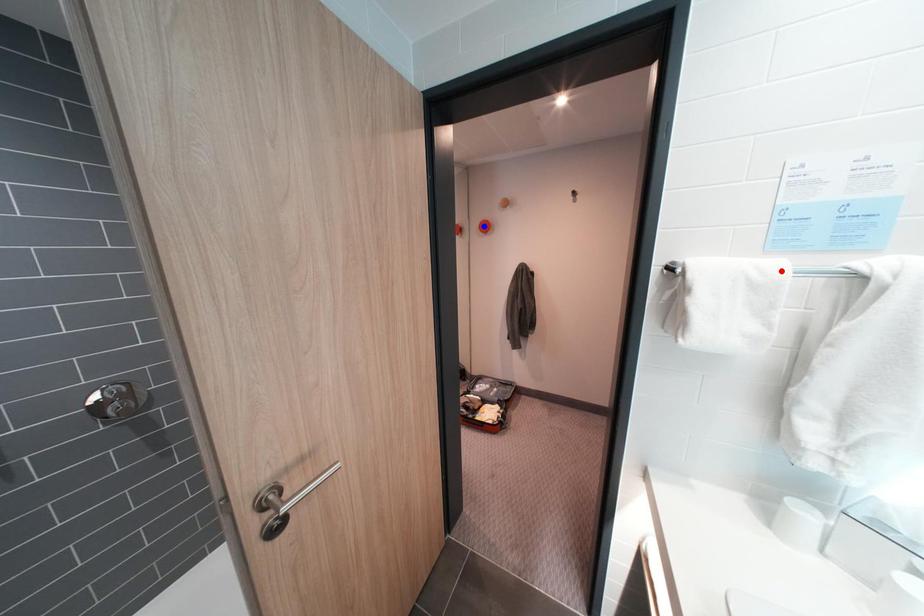
Question: Which of the two points in the image is closer to the camera?

Choices:
 (A) Blue point is closer.
 (B) Red point is closer.

Answer: (B)